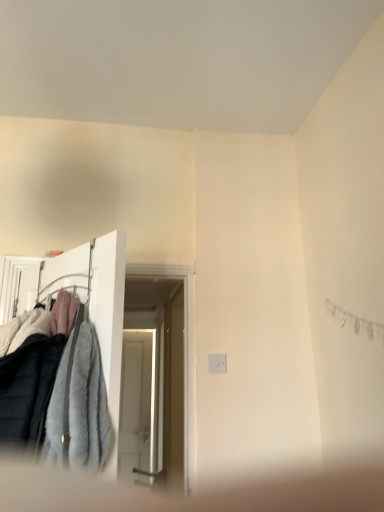
What do you see at coordinates (82, 301) in the screenshot? The width and height of the screenshot is (384, 512). I see `fuzzy fabric coat at left` at bounding box center [82, 301].

The width and height of the screenshot is (384, 512). Identify the location of fuzzy fabric coat at left. (82, 301).

Find the location of a particular element. fuzzy fabric coat at left is located at coordinates (82, 301).